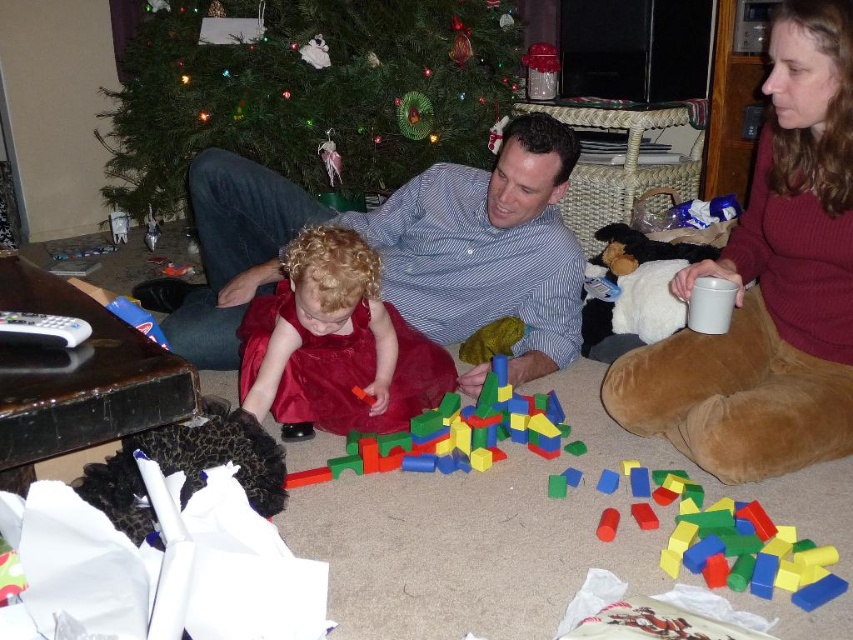
Where is the blue striped shirt at center located in the image?

The blue striped shirt at center is located at point (401, 248) in the image.

You are organizing a clothing donation drive and need to categorize items by size. You have two items in front of you from the image description, the blue striped shirt at center and the velvet red dress at center. Which of these two items is bigger in size?

The blue striped shirt at center is larger in size compared to the velvet red dress at center.